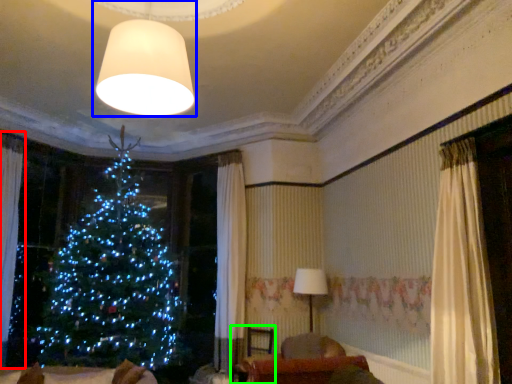
Question: Based on their relative distances, which object is farther from curtain (highlighted by a red box)? Choose from lamp (highlighted by a blue box) and armchair (highlighted by a green box).

Choices:
 (A) lamp
 (B) armchair

Answer: (A)